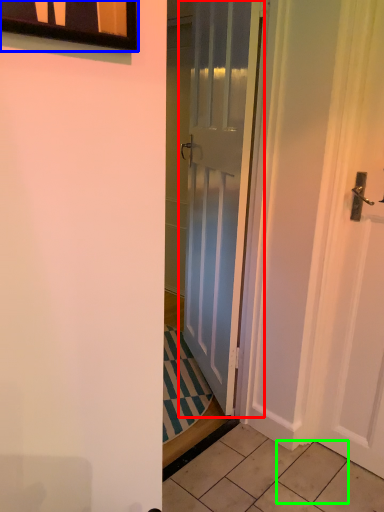
Question: Which object is the closest to the door (highlighted by a red box)? Choose among these: window (highlighted by a blue box) or tile (highlighted by a green box).

Choices:
 (A) window
 (B) tile

Answer: (B)